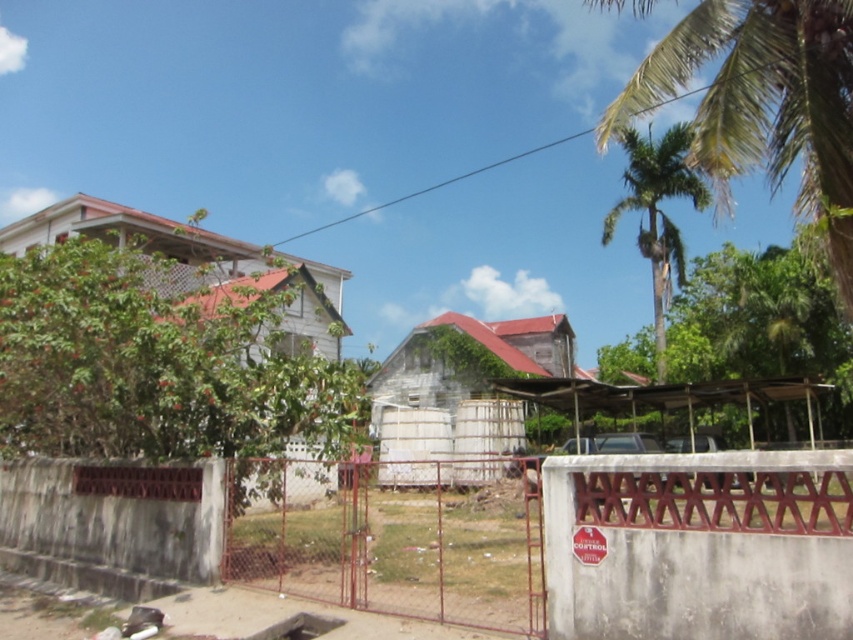
Does point (262, 467) lie in front of point (637, 198)?

Yes, it is in front of point (637, 198).

Who is higher up, rusty metal gate at center or green leafy palm tree at upper right?

green leafy palm tree at upper right

Between point (360, 492) and point (641, 240), which one is positioned behind?

The point (641, 240) is more distant.

I want to click on rusty metal gate at center, so click(386, 544).